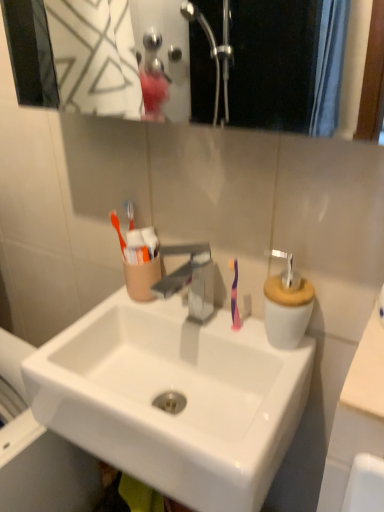
Image resolution: width=384 pixels, height=512 pixels. I want to click on vacant region to the left of purple glossy toothbrush at center, so click(x=165, y=322).